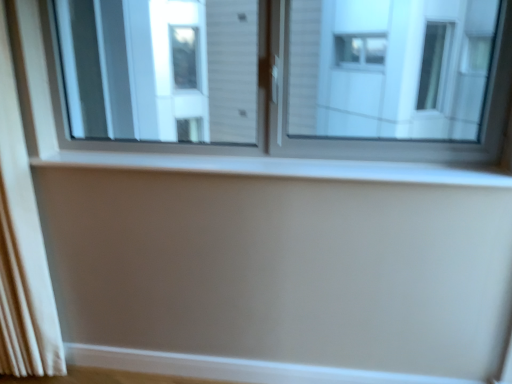
The image size is (512, 384). What do you see at coordinates (278, 167) in the screenshot?
I see `white smooth window sill at center` at bounding box center [278, 167].

What is the approximate width of white smooth window sill at center?

8.03 inches.

Measure the distance between point (296, 176) and camera.

Point (296, 176) is 1.72 meters from camera.

Locate an element on the screen. The height and width of the screenshot is (384, 512). white smooth window sill at center is located at coordinates (278, 167).

You are a GUI agent. You are given a task and a screenshot of the screen. Output one action in this format:
    pyautogui.click(x=<x>, y=<y>)
    Task: Click on the white smooth window sill at center
    The height and width of the screenshot is (384, 512).
    Given the screenshot: What is the action you would take?
    pyautogui.click(x=278, y=167)